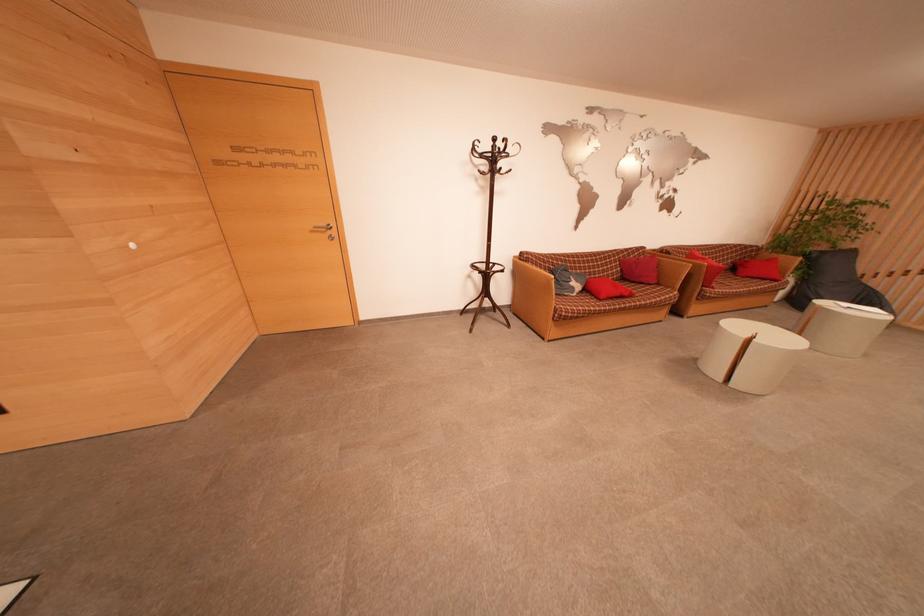
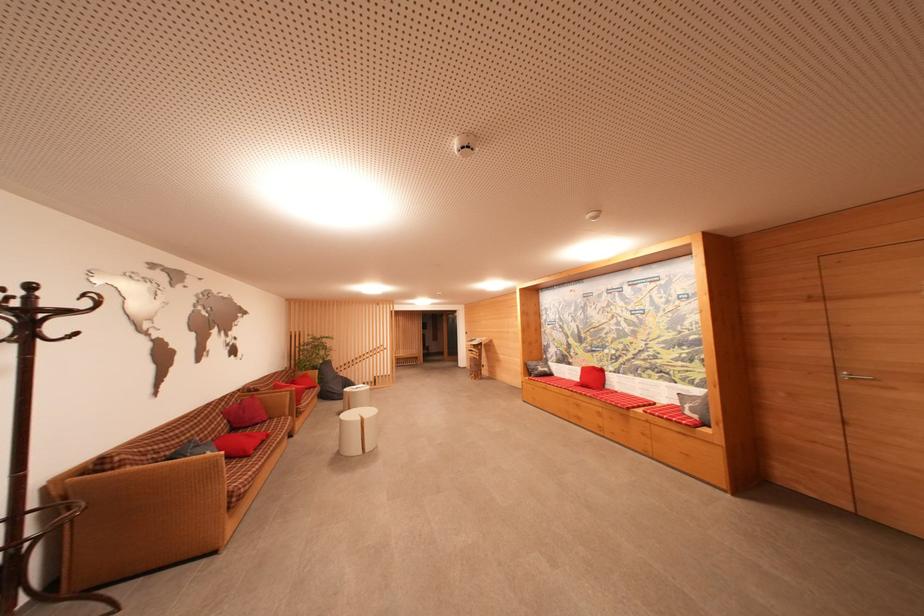
In the second image, find the point that corresponds to (x=627, y=282) in the first image.

(237, 432)